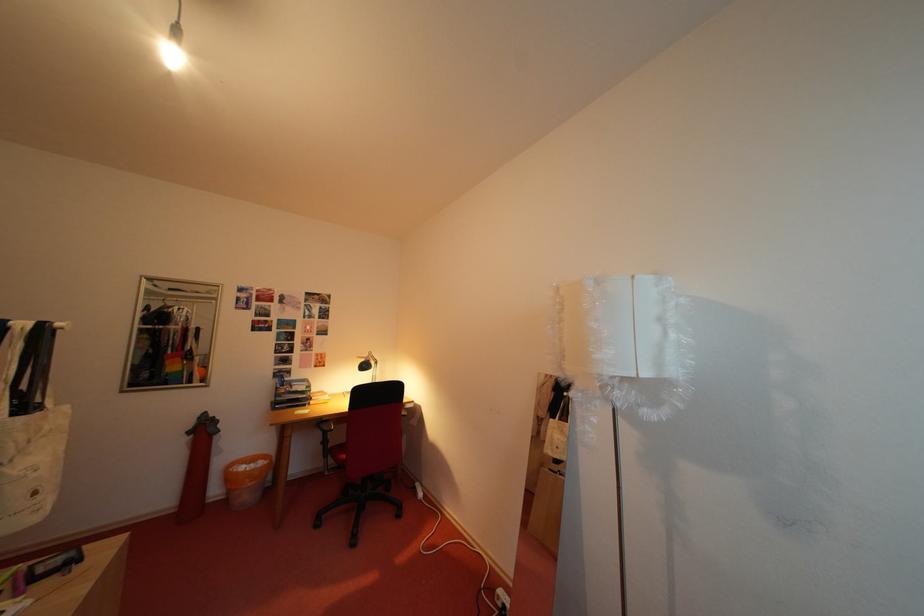
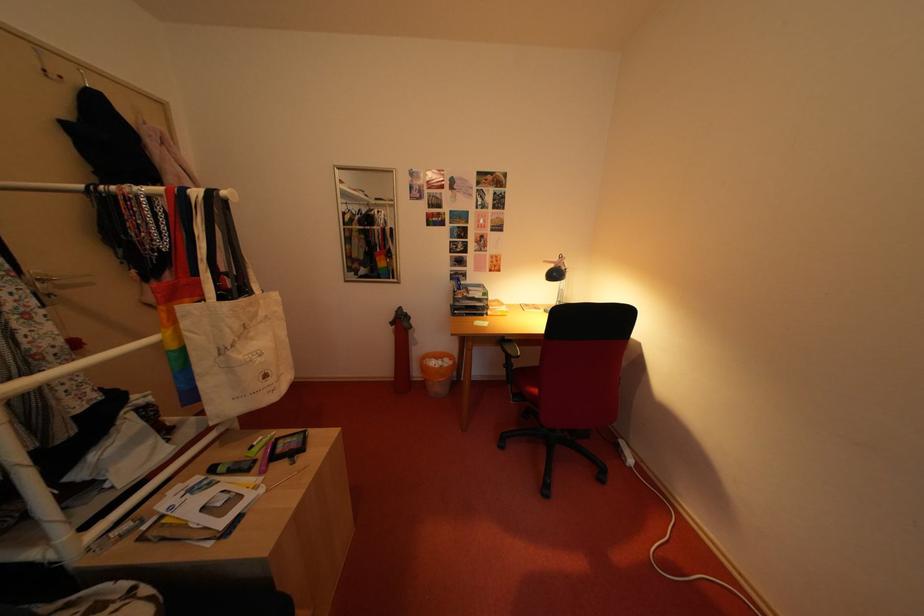
Find the pixel in the second image that matches (x=225, y=496) in the first image.

(427, 379)